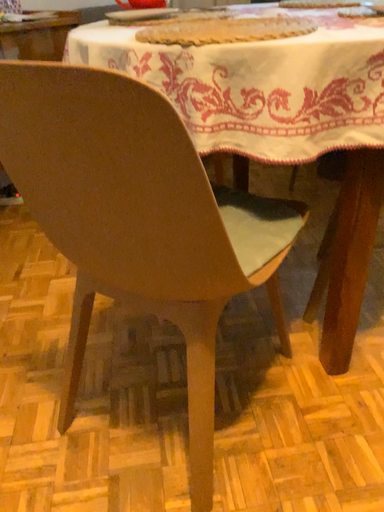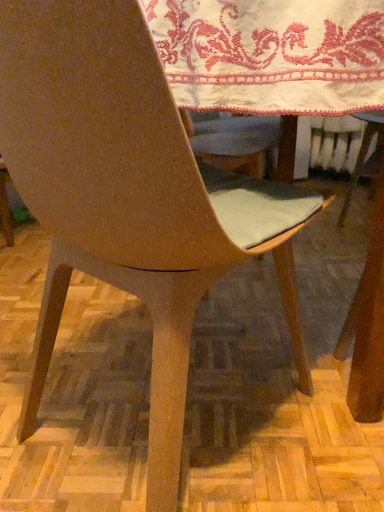
Question: Which way did the camera rotate in the video?

Choices:
 (A) rotated upward
 (B) rotated downward

Answer: (A)